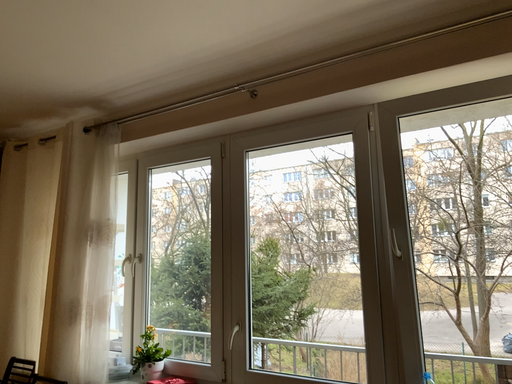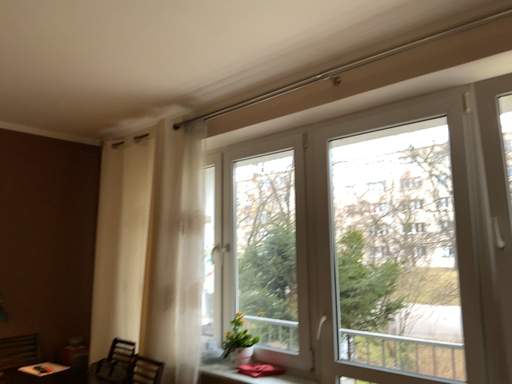
Question: How did the camera likely rotate when shooting the video?

Choices:
 (A) rotated left
 (B) rotated right

Answer: (A)